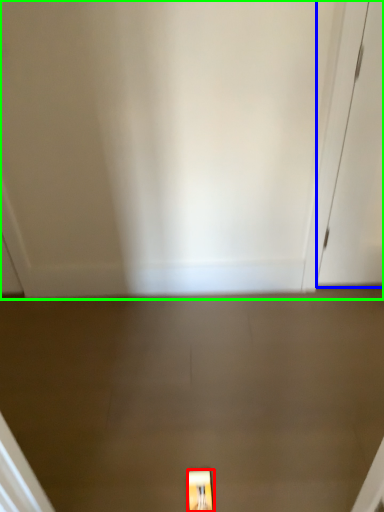
Question: Considering the real-world distances, which object is closest to light fixture (highlighted by a red box)? door (highlighted by a blue box) or door (highlighted by a green box).

Choices:
 (A) door
 (B) door

Answer: (B)